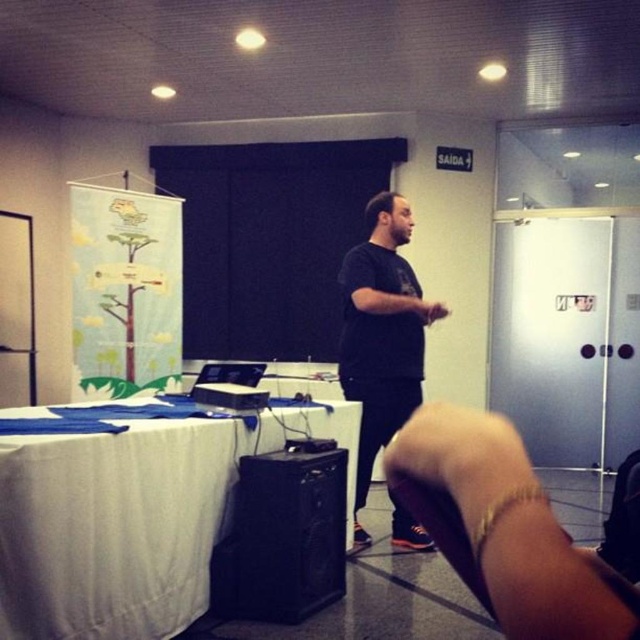
You are standing in the conference room and want to move from point A to point B. Point A is at coordinates point (x=396, y=307) and point B is at coordinates point (x=268, y=396). Which point is closer to you?

Point A at coordinates point (x=396, y=307) is closer to you than point B at coordinates point (x=268, y=396) because it is further to the viewer.

You are a photographer setting up for a presentation. You need to ensure that the black matte shirt at center is visible in the photo without being blocked by the black plastic projector at center. Based on their heights, can you confirm if the shirt will be visible?

The black matte shirt at center has a greater height compared to the black plastic projector at center, so the shirt will be visible and not blocked by the projector.